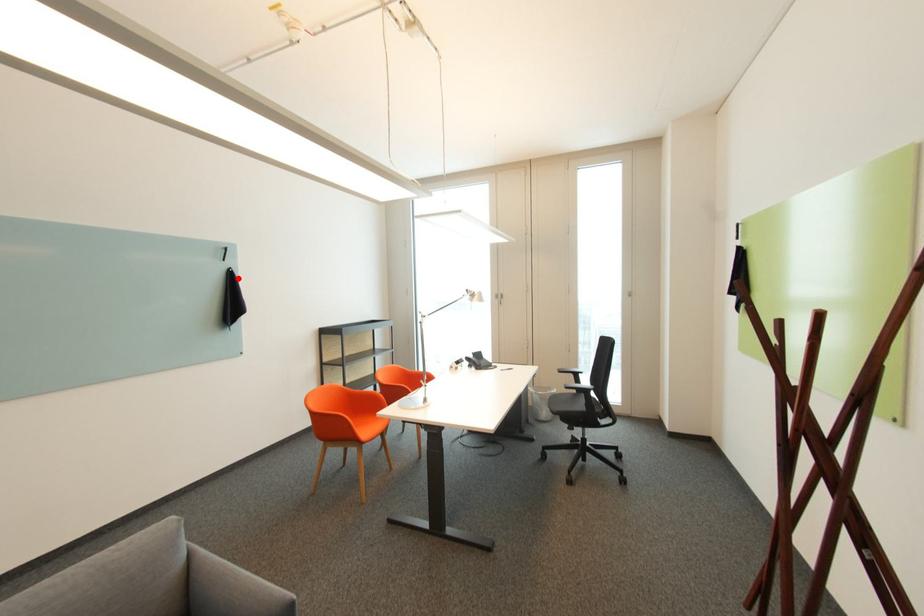
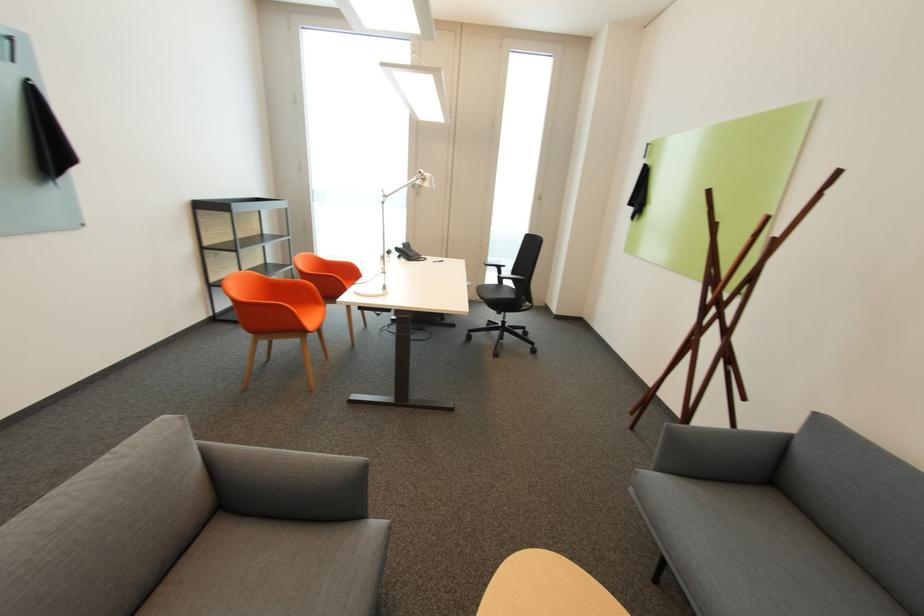
Question: I am providing you with two images of the same scene from different viewpoints. A red point is marked on the first image. Is the red point's position out of view in image 2?

Choices:
 (A) Yes
 (B) No

Answer: (B)